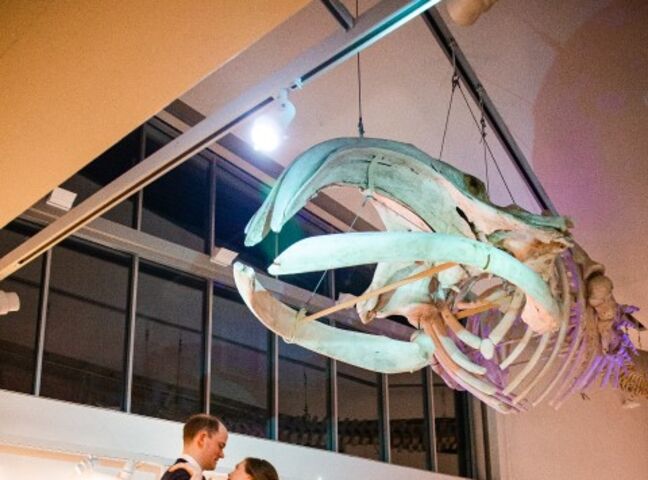
The width and height of the screenshot is (648, 480). I want to click on light fixture, so click(x=259, y=135).